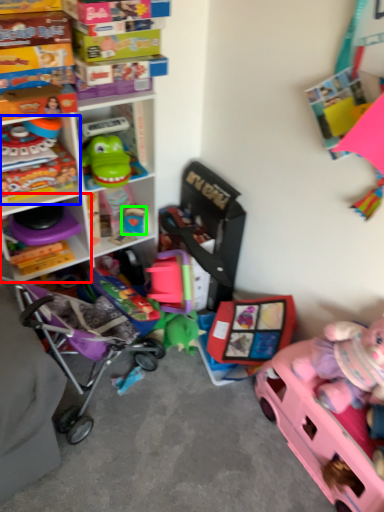
Question: Based on their relative distances, which object is nearer to shelf (highlighted by a red box)? Choose from toy (highlighted by a blue box) and toy (highlighted by a green box).

Choices:
 (A) toy
 (B) toy

Answer: (A)